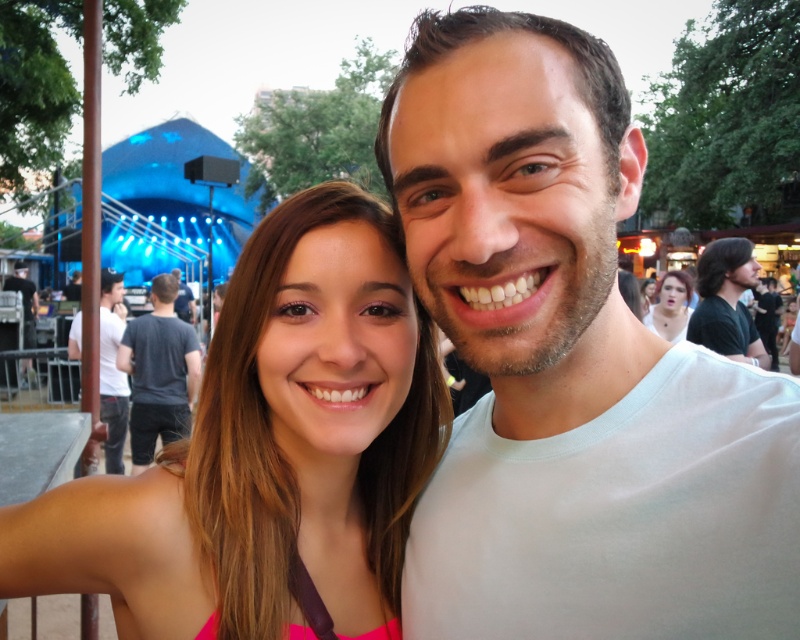
Question: Which of the following is the farthest from the observer?

Choices:
 (A) matte black hair at upper center
 (B) dark gray shirt at left
 (C) black cotton shirt at right

Answer: (B)

Question: Where is pink fabric dress at center located in relation to black cotton shirt at right in the image?

Choices:
 (A) below
 (B) above

Answer: (A)

Question: Among these points, which one is farthest from the camera?

Choices:
 (A) (736, 248)
 (B) (594, 413)
 (C) (682, 332)
 (D) (268, 356)

Answer: (C)

Question: Observing the image, what is the correct spatial positioning of pink fabric dress at center in reference to dark gray shirt at left?

Choices:
 (A) above
 (B) below

Answer: (B)

Question: Is dark gray t-shirt at center to the right of dark gray shirt at left from the viewer's perspective?

Choices:
 (A) yes
 (B) no

Answer: (A)

Question: Which of the following is the closest to the observer?

Choices:
 (A) black cotton shirt at right
 (B) matte black hair at upper center
 (C) white matte shirt at center

Answer: (C)